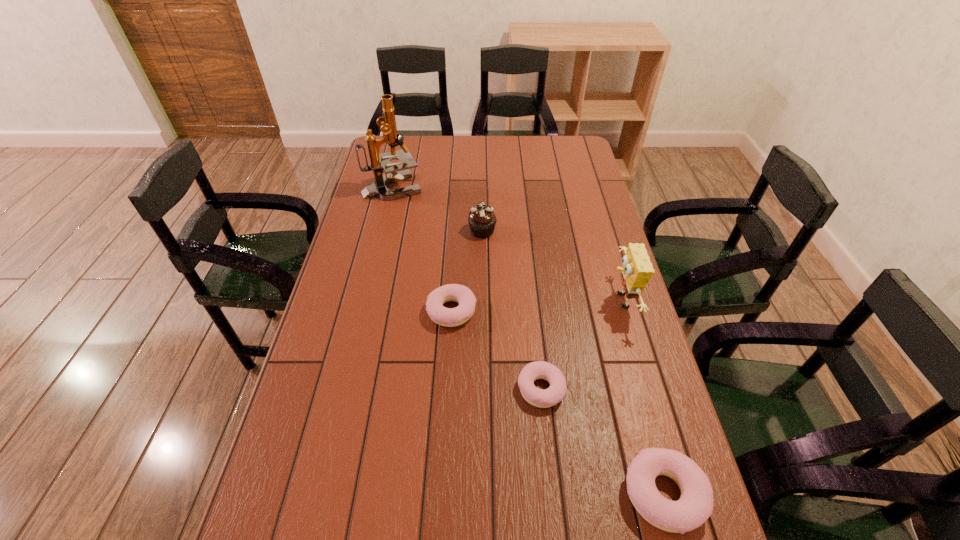
Locate an element on the screen. This screenshot has width=960, height=540. the second shortest object is located at coordinates (449, 317).

Find the location of a particular element. the farthest doughnut is located at coordinates (449, 317).

Locate an element on the screen. This screenshot has height=540, width=960. the fifth farthest object is located at coordinates (551, 396).

I want to click on the second doughnut from right to left, so click(551, 396).

At what (x,y) coordinates should I click in order to perform the action: click on the rightmost doughnut. Please return your answer as a coordinate pair (x, y). Looking at the image, I should click on (695, 506).

Locate an element on the screen. the nearest doughnut is located at coordinates (695, 506).

You are a GUI agent. You are given a task and a screenshot of the screen. Output one action in this format:
    pyautogui.click(x=<x>, y=<y>)
    Task: Click on the leftmost object
    The height and width of the screenshot is (540, 960).
    Given the screenshot: What is the action you would take?
    pyautogui.click(x=378, y=162)

Where is `the farthest object`? This screenshot has height=540, width=960. the farthest object is located at coordinates coord(378,162).

Identify the location of the second tallest object. Image resolution: width=960 pixels, height=540 pixels. (637, 270).

Locate an element on the screen. This screenshot has height=540, width=960. the second farthest object is located at coordinates (482, 220).